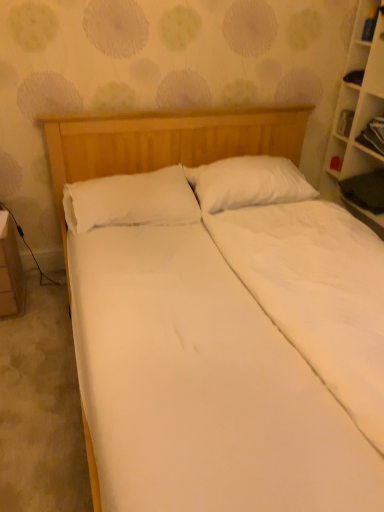
Question: Which is correct: white soft pillow at center, marked as the first pillow in a left-to-right arrangement, is inside white wooden bookcase at right, or outside of it?

Choices:
 (A) inside
 (B) outside

Answer: (B)

Question: Considering their positions, is white soft pillow at center, the 2th pillow from the right, located in front of or behind white wooden bookcase at right?

Choices:
 (A) behind
 (B) front

Answer: (A)

Question: Estimate the real-world distances between objects in this image. Which object is closer to the white glossy table at lower left?

Choices:
 (A) white soft pillow at center, which ranks as the second pillow in left-to-right order
 (B) white wooden bookcase at right
 (C) white soft pillow at center, marked as the first pillow in a left-to-right arrangement
 (D) wooden cabinet at right

Answer: (C)

Question: Which of these objects is positioned closest to the wooden cabinet at right?

Choices:
 (A) white glossy table at lower left
 (B) white soft pillow at center, which appears as the 1th pillow when viewed from the right
 (C) white soft pillow at center, marked as the first pillow in a left-to-right arrangement
 (D) white wooden bookcase at right

Answer: (D)